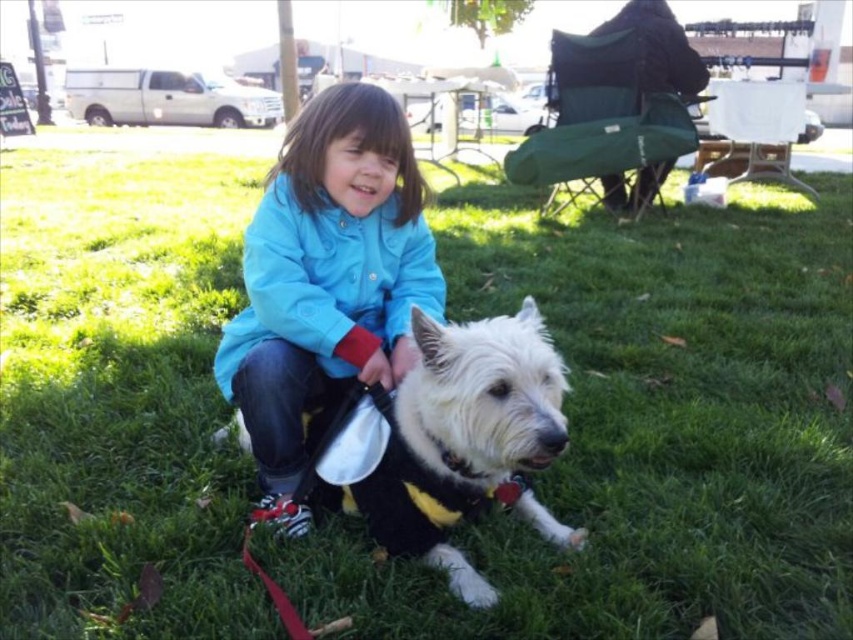
Is point (271, 268) less distant than point (541, 452)?

No, (271, 268) is further to viewer.

Looking at this image, which is below, blue fabric jacket at center or white fluffy dog at center?

white fluffy dog at center is lower down.

Locate an element on the screen. This screenshot has width=853, height=640. blue fabric jacket at center is located at coordinates (328, 280).